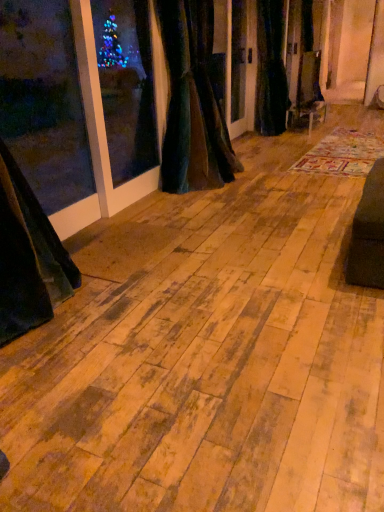
Question: From a real-world perspective, relative to velvet dark green curtain at center, the 1th curtain when ordered from left to right, is multicolored woven rug at center vertically above or below?

Choices:
 (A) below
 (B) above

Answer: (A)

Question: Is point (350, 140) closer or farther from the camera than point (216, 109)?

Choices:
 (A) farther
 (B) closer

Answer: (A)

Question: Which of these objects is positioned farthest from the multicolored woven rug at center?

Choices:
 (A) velvet dark green curtain at center, which ranks as the 1th curtain in right-to-left order
 (B) velvet dark green curtain at center, the 1th curtain when ordered from left to right

Answer: (B)

Question: Estimate the real-world distances between objects in this image. Which object is closer to the velvet dark green curtain at center, which is the 1th curtain from front to back?

Choices:
 (A) velvet dark green curtain at center, which ranks as the 1th curtain in right-to-left order
 (B) multicolored woven rug at center

Answer: (B)